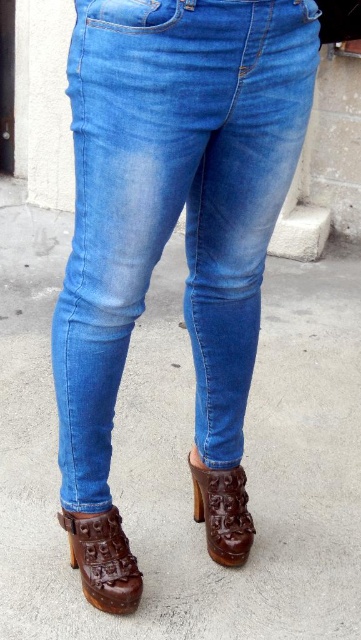
Consider the image. Can you confirm if denim jeans at center is wider than brown leather shoe at lower left?

Result: Yes.

Is point (145, 0) closer to viewer compared to point (81, 518)?

Yes.

Which is behind, point (79, 58) or point (85, 547)?

Positioned behind is point (85, 547).

The width and height of the screenshot is (361, 640). Find the location of `denim jeans at center`. denim jeans at center is located at coordinates (174, 202).

Who is positioned more to the right, denim jeans at center or brown leather sandal at lower center?

Positioned to the right is brown leather sandal at lower center.

Identify the location of denim jeans at center. The image size is (361, 640). (174, 202).

This screenshot has height=640, width=361. Describe the element at coordinates (174, 202) in the screenshot. I see `denim jeans at center` at that location.

Find the location of a particular element. denim jeans at center is located at coordinates (174, 202).

Find the location of a particular element. The width and height of the screenshot is (361, 640). brown leather shoe at lower left is located at coordinates (102, 560).

Locate an element on the screen. Image resolution: width=361 pixels, height=640 pixels. brown leather shoe at lower left is located at coordinates (102, 560).